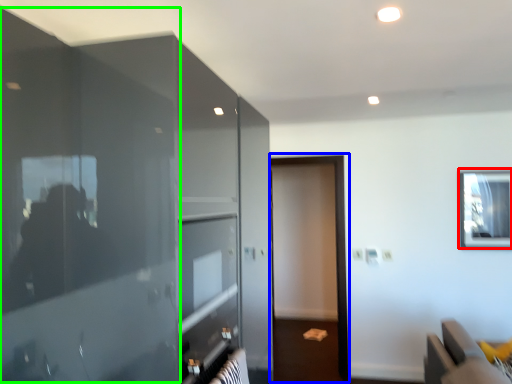
Question: Which is farther away from window (highlighted by a red box)? screen door (highlighted by a blue box) or glass door (highlighted by a green box)?

Choices:
 (A) screen door
 (B) glass door

Answer: (B)